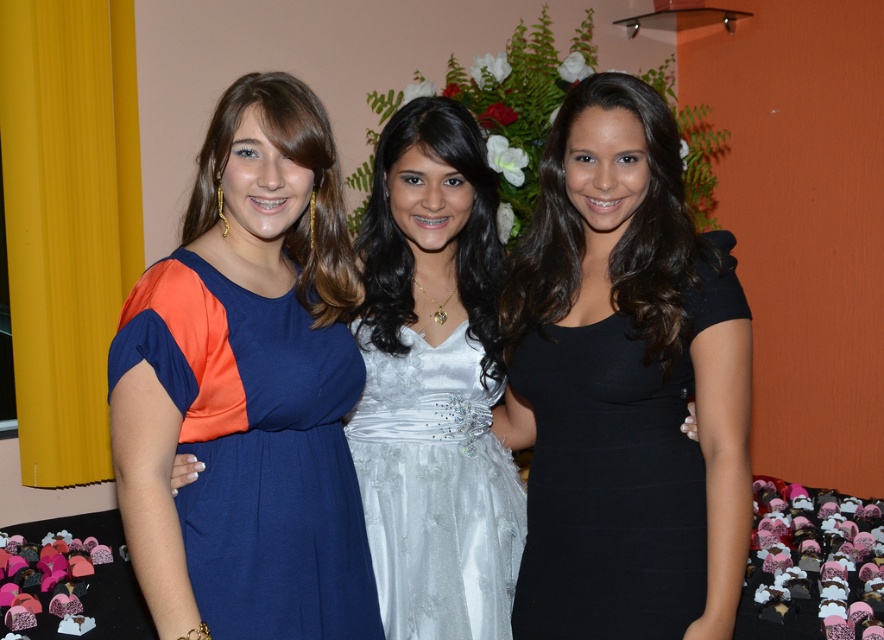
Question: Considering the real-world distances, which object is closest to the satin blue dress at center?

Choices:
 (A) satin white dress at center
 (B) black matte dress at center

Answer: (A)

Question: Which object appears closest to the camera in this image?

Choices:
 (A) satin white dress at center
 (B) black matte dress at center

Answer: (B)

Question: Can you confirm if satin blue dress at center is wider than satin white dress at center?

Choices:
 (A) no
 (B) yes

Answer: (B)

Question: Which of the following is the closest to the observer?

Choices:
 (A) black matte dress at center
 (B) satin white dress at center

Answer: (A)

Question: In this image, where is black matte dress at center located relative to satin white dress at center?

Choices:
 (A) right
 (B) left

Answer: (A)

Question: Can you confirm if satin blue dress at center is thinner than black matte dress at center?

Choices:
 (A) no
 (B) yes

Answer: (B)